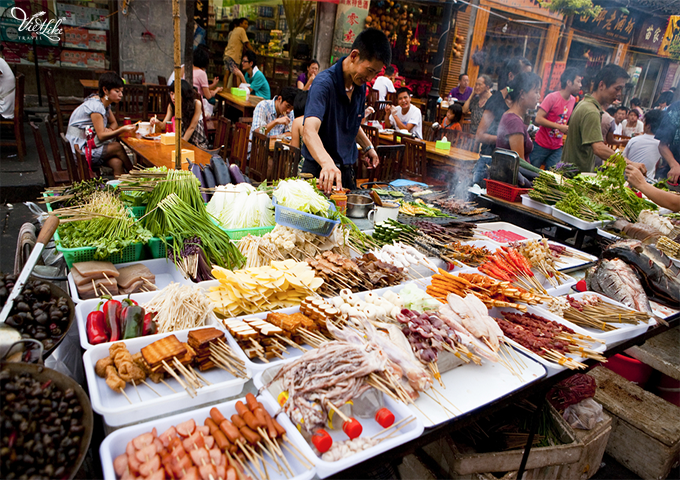
Locate an element on the screen. Image resolution: width=680 pixels, height=480 pixels. table is located at coordinates (153, 145).